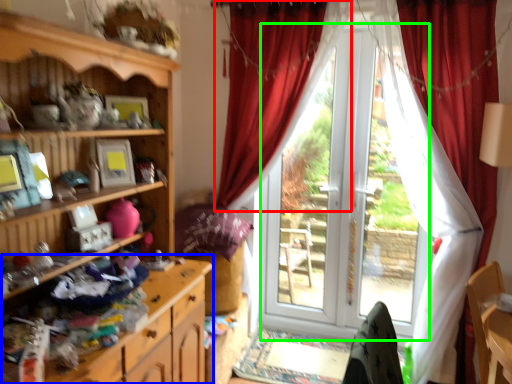
Question: Considering the real-world distances, which object is farthest from curtain (highlighted by a red box)? cabinetry (highlighted by a blue box) or screen door (highlighted by a green box)?

Choices:
 (A) cabinetry
 (B) screen door

Answer: (A)